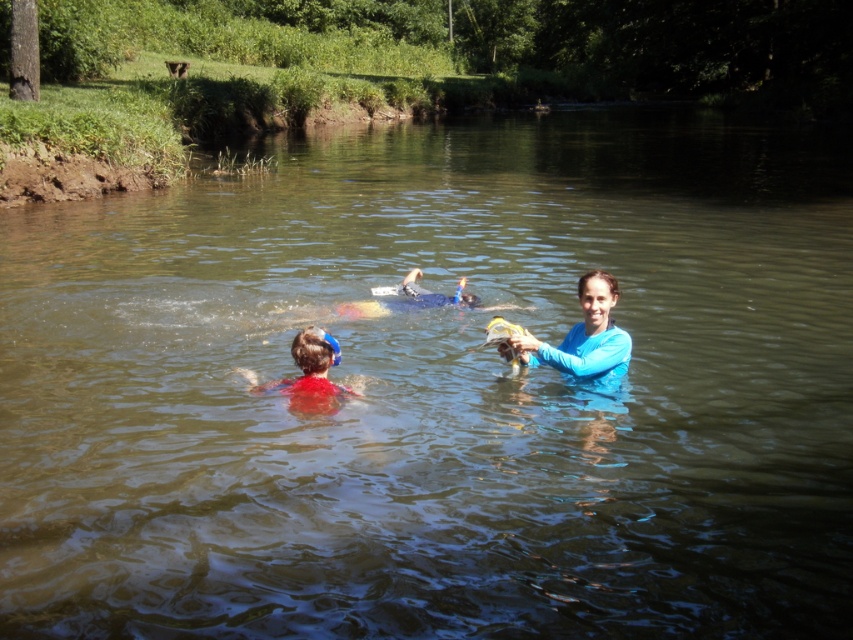
Can you confirm if matte red swim cap at center is taller than blue rubber snorkel at center?

Yes, matte red swim cap at center is taller than blue rubber snorkel at center.

Which is behind, point (306, 369) or point (424, 292)?

Positioned behind is point (424, 292).

What are the coordinates of `matte red swim cap at center` in the screenshot? It's located at (311, 374).

Does blue matte shirt at center lie behind blue rubber snorkel at center?

No, blue matte shirt at center is closer to the viewer.

Can you confirm if blue matte shirt at center is positioned above blue rubber snorkel at center?

No, blue matte shirt at center is not above blue rubber snorkel at center.

Does point (596, 372) lie behind point (408, 289)?

No, it is not.

This screenshot has width=853, height=640. Identify the location of blue matte shirt at center. (583, 339).

This screenshot has height=640, width=853. What do you see at coordinates (583, 339) in the screenshot?
I see `blue matte shirt at center` at bounding box center [583, 339].

Locate an element on the screen. blue matte shirt at center is located at coordinates (583, 339).

At what (x,y) coordinates should I click in order to perform the action: click on blue matte shirt at center. Please return your answer as a coordinate pair (x, y). This screenshot has height=640, width=853. Looking at the image, I should click on (583, 339).